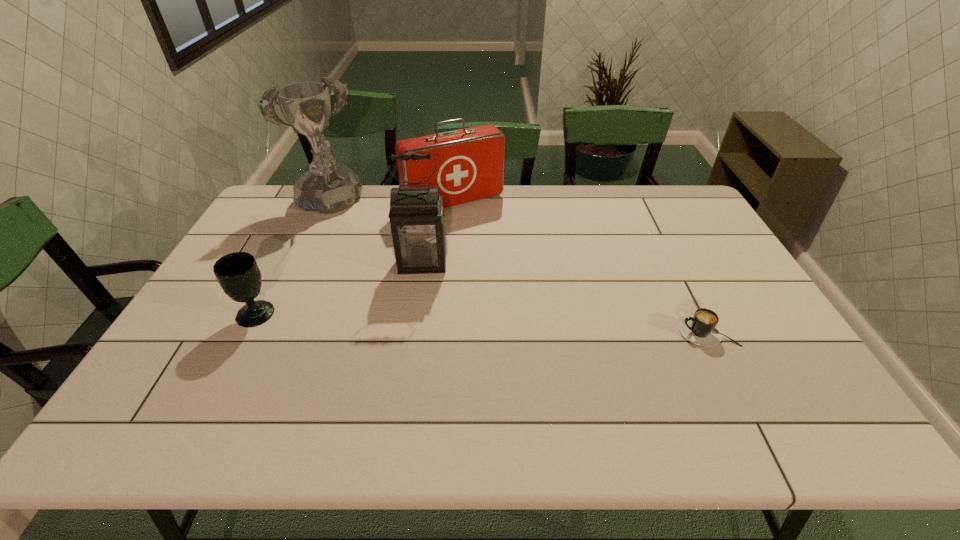
The height and width of the screenshot is (540, 960). Identify the location of object identified as the fourth closest to the chalice. (701, 329).

The image size is (960, 540). In order to click on object that is the third closest to the third farthest object in this screenshot , I will do `click(238, 274)`.

This screenshot has width=960, height=540. Find the location of `vacant point that satisfies the following two spatial constraints: 1. on the back side of the third shortest object; 2. on the right side of the chalice`. vacant point that satisfies the following two spatial constraints: 1. on the back side of the third shortest object; 2. on the right side of the chalice is located at coordinates [314, 202].

This screenshot has height=540, width=960. I want to click on free region that satisfies the following two spatial constraints: 1. on the front side of the cappuccino; 2. with the handle on the side of the award, so click(x=268, y=332).

Identify the location of vacant space that satisfies the following two spatial constraints: 1. on the front side of the fourth tallest object; 2. with the handle on the side of the shortest object. (247, 332).

This screenshot has height=540, width=960. Find the location of `free spot that satisfies the following two spatial constraints: 1. on the back side of the second shortest object; 2. on the left side of the first-aid kit`. free spot that satisfies the following two spatial constraints: 1. on the back side of the second shortest object; 2. on the left side of the first-aid kit is located at coordinates (314, 202).